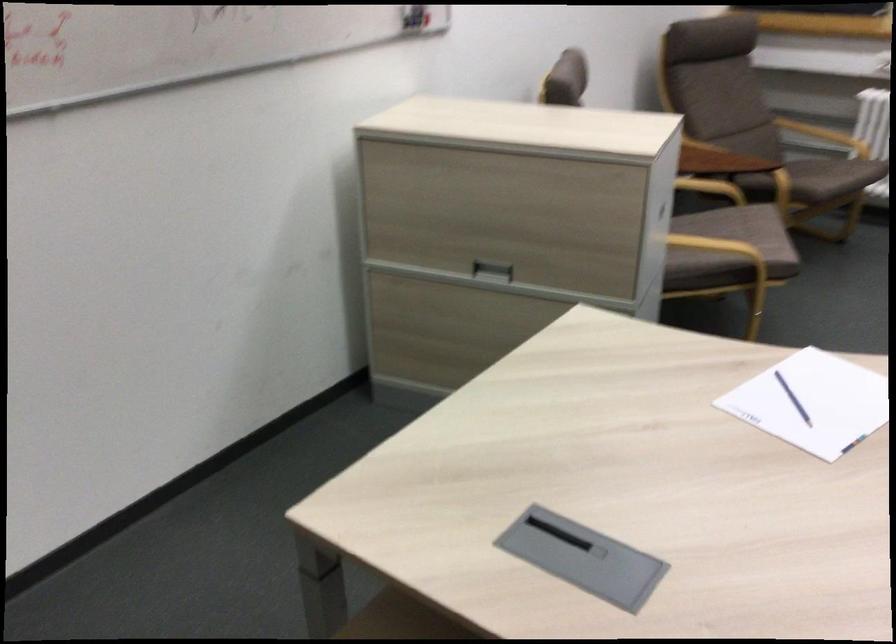
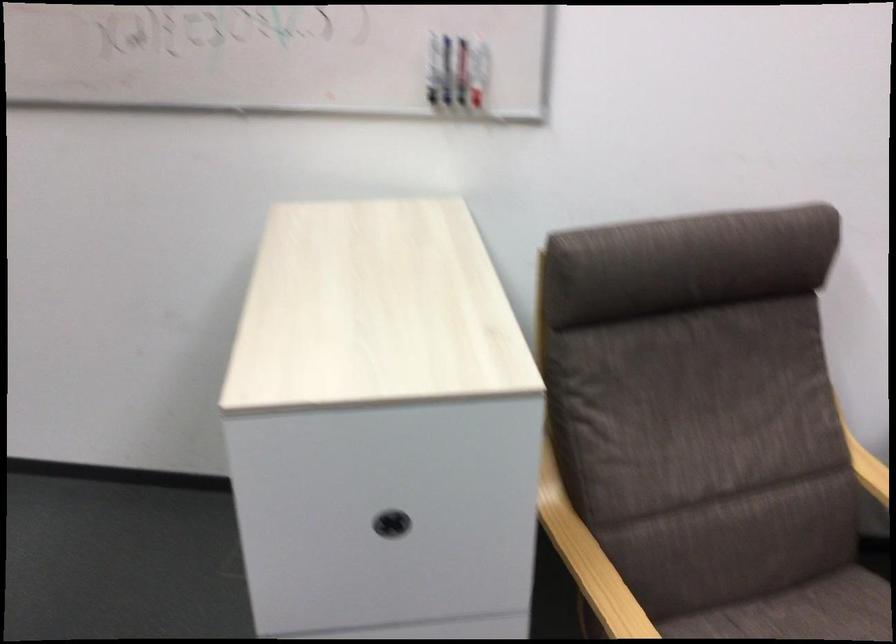
Question: I am providing you with two images of the same scene from different viewpoints. Please identify which objects are invisible in image2.

Choices:
 (A) black drawer handle
 (B) cabinet drawer handle
 (C) fan control hub
 (D) chair sitting surface

Answer: (B)